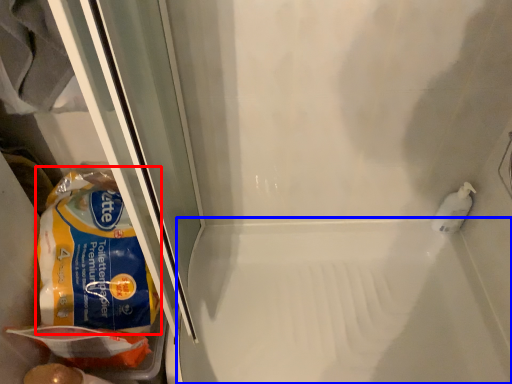
Question: Which of the following is the closest to the observer, cereal (highlighted by a red box) or bath (highlighted by a blue box)?

Choices:
 (A) cereal
 (B) bath

Answer: (A)